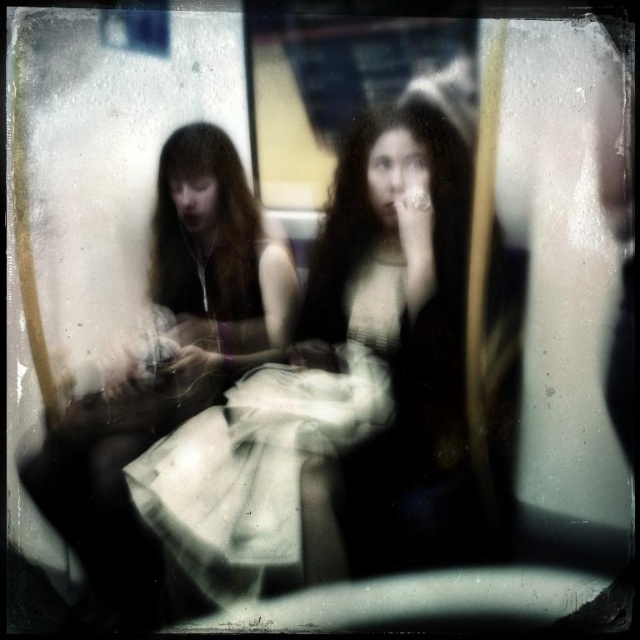
You are a photographer who wants to ensure the two dresses in the image are visible in the final photo. Given that the white fabric dress at center is much taller than the white cotton dress at center, which dress might be more likely to block the view of the other in the photo?

The white fabric dress at center is much taller than the white cotton dress at center, so it might block the view of the white cotton dress at center.

Based on the photo, you are a photographer who wants to capture a clear portrait of both the long reddish brown hair person on the left and the white fabric dress at center. Given that the camera you have can focus on objects within a 1.5 meter range, will both subjects be in focus?

The two subjects are 1.43 meters apart, which is within the camera focus range of 1.5 meters. Therefore, both the long reddish brown hair person on the left and the white fabric dress at center should be in focus.